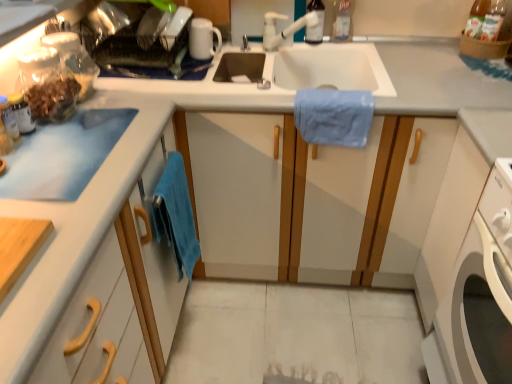
You are a GUI agent. You are given a task and a screenshot of the screen. Output one action in this format:
    pyautogui.click(x=<x>, y=<y>)
    Task: Click on the free spot to the right of transparent plastic bottle at upper center, the first bottle from the left
    The image size is (512, 384).
    Given the screenshot: What is the action you would take?
    pyautogui.click(x=364, y=48)